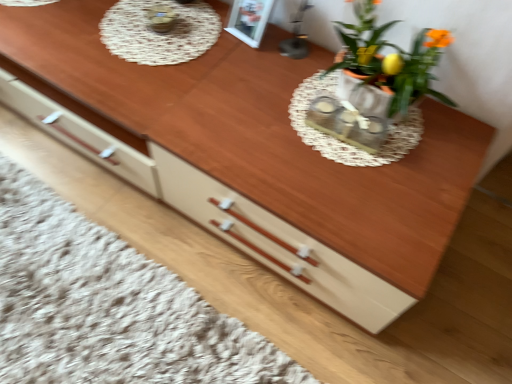
Image resolution: width=512 pixels, height=384 pixels. I want to click on free spot below white lace doily at upper center (from a real-world perspective), so click(x=158, y=30).